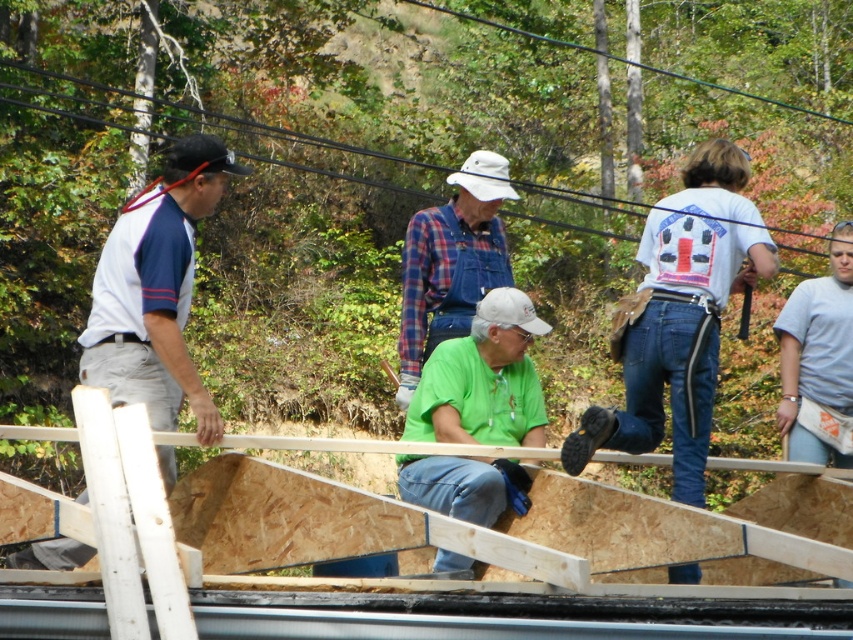
Question: Can you confirm if green matte shirt at center is smaller than plaid fabric shirt at center?

Choices:
 (A) yes
 (B) no

Answer: (A)

Question: Among these objects, which one is nearest to the camera?

Choices:
 (A) plaid fabric shirt at center
 (B) green matte shirt at center

Answer: (B)

Question: Does green matte shirt at center lie behind plaid fabric shirt at center?

Choices:
 (A) yes
 (B) no

Answer: (B)

Question: Which point is farther from the camera taking this photo?

Choices:
 (A) (445, 552)
 (B) (430, 326)
 (C) (105, 330)

Answer: (B)

Question: Estimate the real-world distances between objects in this image. Which object is farther from the white fabric shirt at left?

Choices:
 (A) green matte shirt at center
 (B) plaid fabric shirt at center

Answer: (B)

Question: Does white fabric shirt at left appear under plaid fabric shirt at center?

Choices:
 (A) no
 (B) yes

Answer: (B)